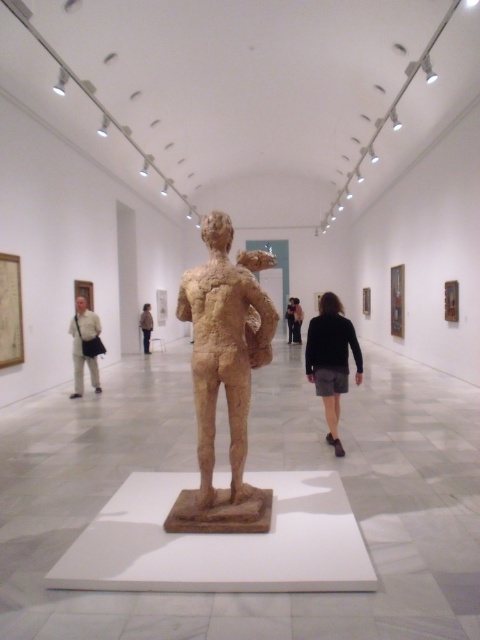
You are an art curator planning to move the brown clay figure at center and the light brown textured sculpture at center closer together to create a more cohesive display. Given that the gallery floor is 15 meters long, is there enough space to bring them closer without exceeding the gallery length?

The distance between the brown clay figure at center and the light brown textured sculpture at center is 13.09 meters. Since the gallery floor is 15 meters long, there is sufficient space to move them closer together without exceeding the gallery length.

You are an art curator planning to move the brown clay figure at center and the light brown textured sculpture at center to a new exhibition space. The new space has a narrow corridor that can only accommodate items up to 1 meter in width. Which of the two items might not fit through the corridor?

The brown clay figure at center might not fit through the corridor since it might be wider than the light brown textured sculpture at center, and the corridor has a 1 meter width limit.

You are an art curator planning to install a new light fixture in the gallery. The light needs to illuminate both the brown clay figure at center and the dark gray fabric skirt at center without casting shadows on the walls. Given their positions, which object should the light be directed towards first to ensure both are well lit?

The light should be directed towards the brown clay figure at center first since it is located above the dark gray fabric skirt at center. By illuminating the higher object first, the light can then naturally reach the lower one, ensuring both are well lit without casting shadows on the walls.